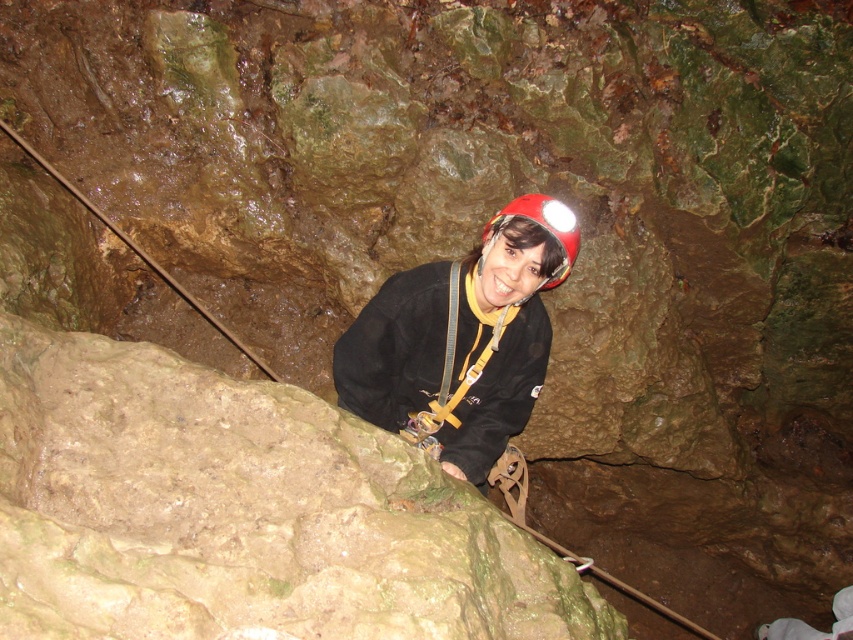
You are a caver preparing to descend into a dark cave. You have a headlamp and a map showing coordinates. According to the map, there is a matte black jacket at center located at point (462, 337). If you are currently at the entrance facing the cave, which direction should you move to reach the matte black jacket at center?

The matte black jacket at center is located at point (462, 337), so you should move towards the center of the cave from the entrance to reach it.

Based on the scene description, can you determine if the matte black jacket at center is wider than the red matte helmet at center?

The matte black jacket at center might be wider than red matte helmet at center according to the description.